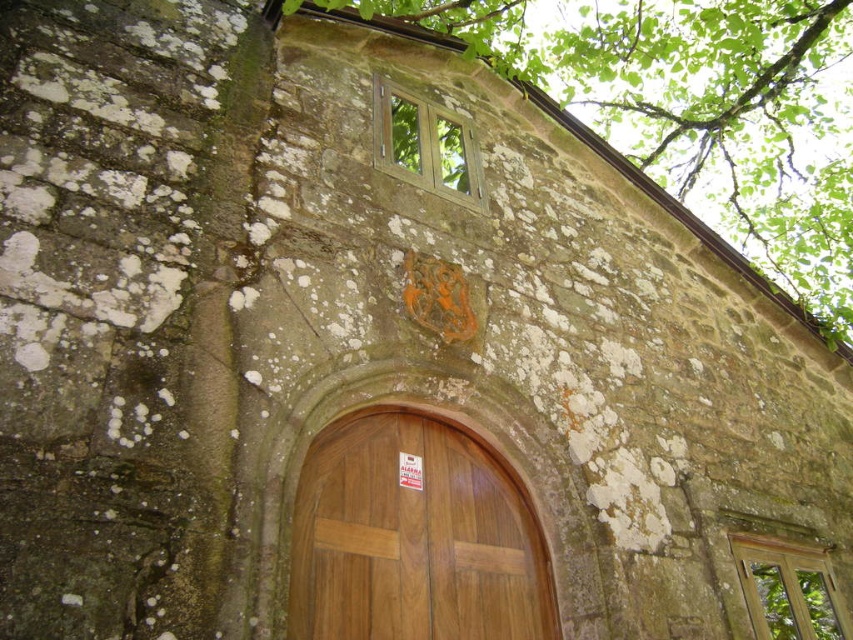
Is green leafy tree at upper center in front of wooden door at center?

That is False.

Can you confirm if green leafy tree at upper center is thinner than wooden door at center?

No.

Identify the location of green leafy tree at upper center. (689, 106).